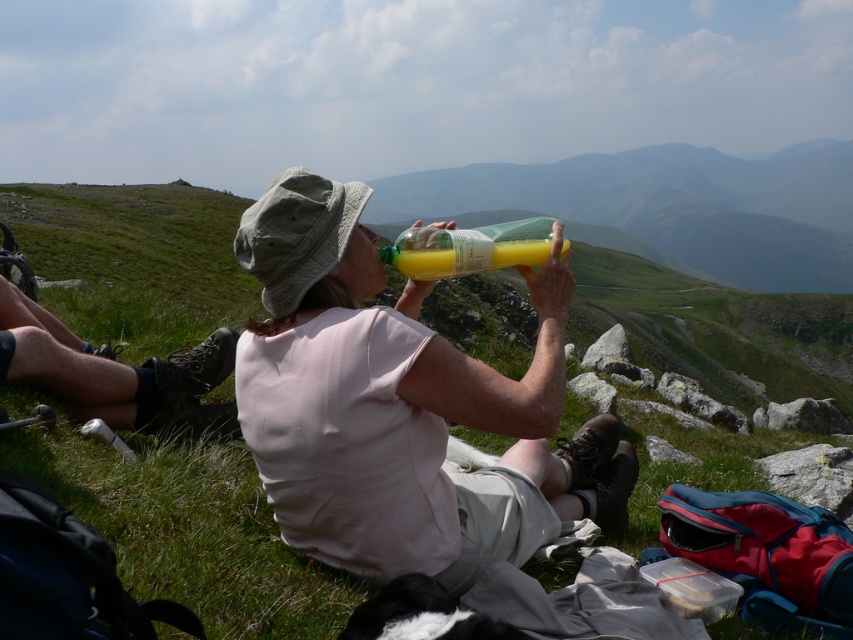
Can you confirm if khaki fabric hat at center is positioned to the right of translucent yellow liquid at upper center?

No, khaki fabric hat at center is not to the right of translucent yellow liquid at upper center.

Is point (257, 244) positioned after point (461, 237)?

No, (257, 244) is in front of (461, 237).

Which is in front, point (305, 266) or point (515, 248)?

Point (305, 266) is in front.

Where is `khaki fabric hat at center`? The image size is (853, 640). khaki fabric hat at center is located at coordinates (294, 237).

Which is more to the left, matte plastic bottle at center or khaki fabric hat at center?

Positioned to the left is khaki fabric hat at center.

Is matte plastic bottle at center thinner than khaki fabric hat at center?

In fact, matte plastic bottle at center might be wider than khaki fabric hat at center.

Is point (363, 234) behind point (328, 248)?

Yes, it is.

Locate an element on the screen. This screenshot has width=853, height=640. matte plastic bottle at center is located at coordinates (401, 404).

Between point (260, 342) and point (474, 252), which one is positioned behind?

Point (474, 252)

Can you confirm if matte plastic bottle at center is bigger than translucent yellow liquid at upper center?

Indeed, matte plastic bottle at center has a larger size compared to translucent yellow liquid at upper center.

The height and width of the screenshot is (640, 853). I want to click on matte plastic bottle at center, so click(401, 404).